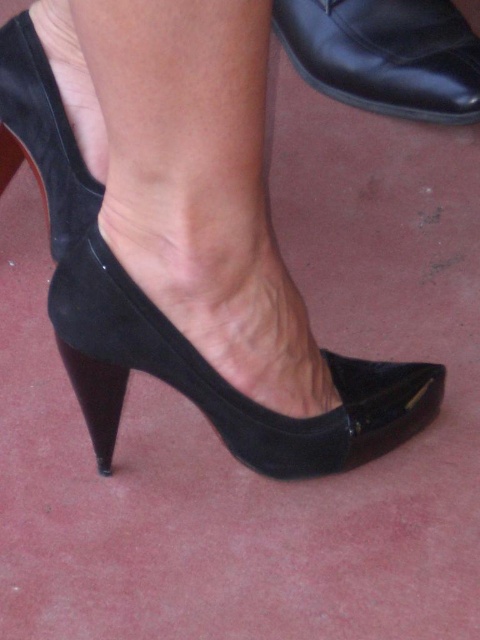
Question: Which object appears farthest from the camera in this image?

Choices:
 (A) black suede shoe at upper right
 (B) suede black high-heeled shoe at center

Answer: (A)

Question: Can you confirm if suede black high-heeled shoe at center is positioned to the left of black suede shoe at upper right?

Choices:
 (A) no
 (B) yes

Answer: (B)

Question: Is suede black high-heeled shoe at center below black suede shoe at upper right?

Choices:
 (A) no
 (B) yes

Answer: (B)

Question: Which object appears closest to the camera in this image?

Choices:
 (A) black suede shoe at upper right
 (B) suede black high-heeled shoe at center

Answer: (B)

Question: Is suede black high-heeled shoe at center bigger than black suede shoe at upper right?

Choices:
 (A) no
 (B) yes

Answer: (B)